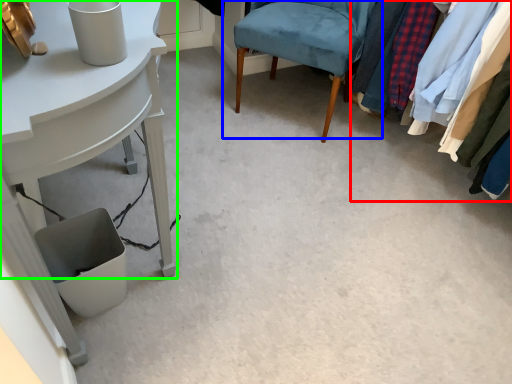
Question: Which is farther away from closet (highlighted by a red box)? chair (highlighted by a blue box) or table (highlighted by a green box)?

Choices:
 (A) chair
 (B) table

Answer: (B)